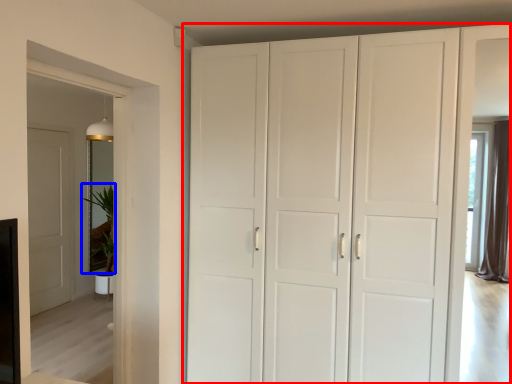
Question: Which of the following is the closest to the observer, cupboard (highlighted by a red box) or plant (highlighted by a blue box)?

Choices:
 (A) cupboard
 (B) plant

Answer: (A)